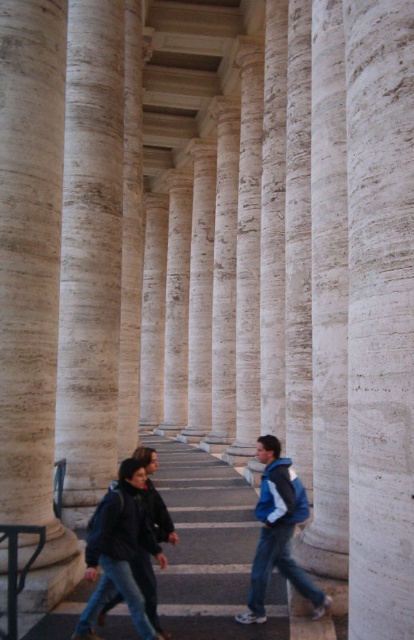
You are standing on the pathway in front of the columns and see two points marked on the ground. One is labeled as point [14,349] and the other is point [300,504]. Which point is closer to you?

Point [14,349] is closer to you because it is further to the viewer than point [300,504].

You are standing on the pathway and want to walk towards the smooth white column at center. Which direction should you move relative to the black metal balustrade at lower left?

The smooth white column at center is positioned over the black metal balustrade at lower left, so you should move towards the black metal balustrade at lower left to reach the smooth white column at center.